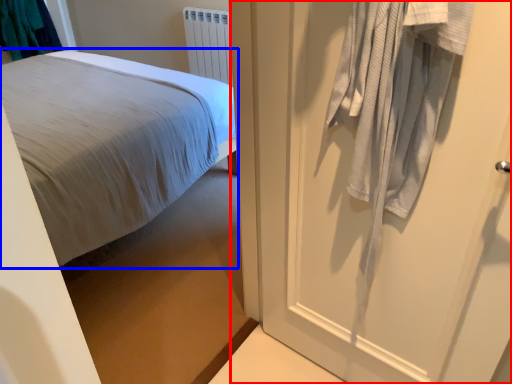
Question: Which object appears farthest to the camera in this image, door (highlighted by a red box) or bed (highlighted by a blue box)?

Choices:
 (A) door
 (B) bed

Answer: (B)